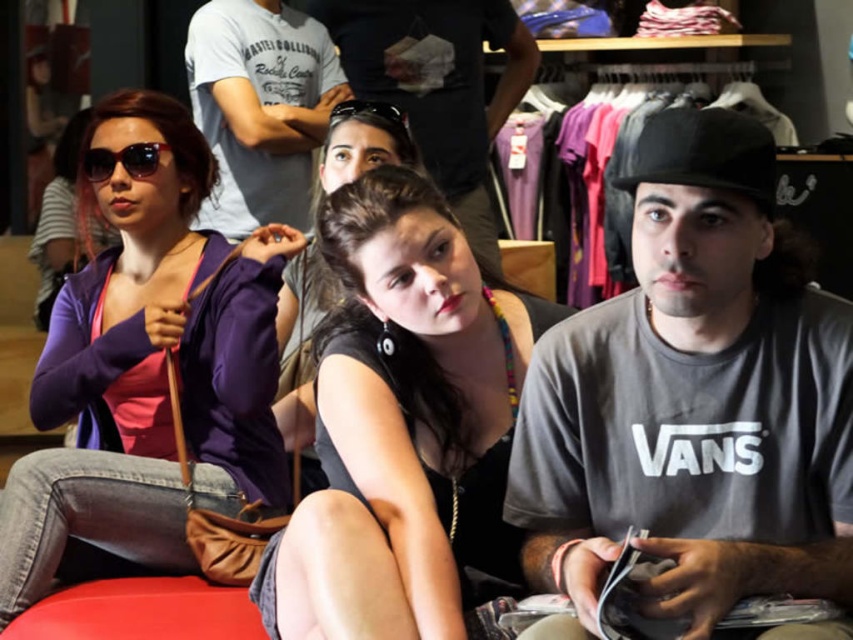
Please look at the image and identify which object is located at the coordinates point (693, 397). Choose from the following options based on the scene description provided. The options are the gray matte vans t shirt at center, the purple jacket over a pink top on the left, or the black sleeveless top and large hoop earrings in the center.

The point (693, 397) corresponds to the gray matte vans t shirt at center.